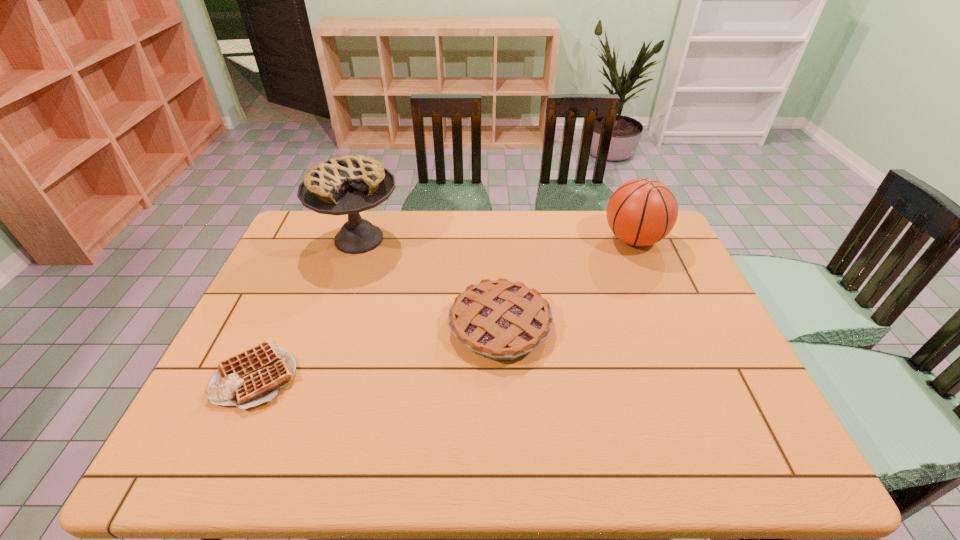
The height and width of the screenshot is (540, 960). Identify the location of vacant space at the left edge. 279,256.

Find the location of `vacant area at the right edge`. vacant area at the right edge is located at coordinates (696, 283).

Where is `free space at the near left corner of the desktop`? Image resolution: width=960 pixels, height=540 pixels. free space at the near left corner of the desktop is located at coordinates (210, 462).

In the image, there is a desktop. Where is `vacant area at the near right corner`? The height and width of the screenshot is (540, 960). vacant area at the near right corner is located at coordinates (754, 455).

The height and width of the screenshot is (540, 960). I want to click on vacant point located between the basketball and the tallest object, so click(496, 239).

This screenshot has width=960, height=540. I want to click on free spot between the nearer pie and the tallest object, so click(429, 282).

Where is `free space between the rightmost object and the tallest object`? This screenshot has width=960, height=540. free space between the rightmost object and the tallest object is located at coordinates (496, 239).

What are the coordinates of `vacant space that's between the left pie and the waffle` in the screenshot? It's located at (308, 307).

Locate an element on the screen. This screenshot has height=540, width=960. empty space that is in between the shortest object and the third object from left to right is located at coordinates (378, 350).

The image size is (960, 540). Identify the location of vacant region between the third tallest object and the left pie. (429, 282).